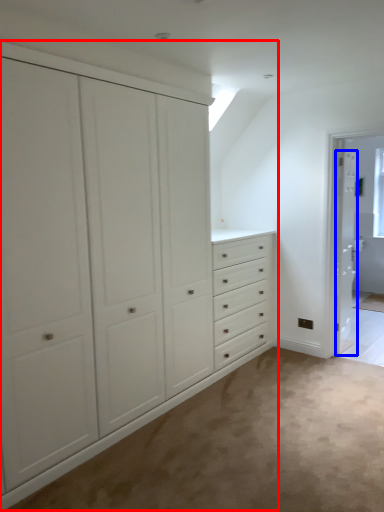
Question: Which point is closer to the camera, cupboard (highlighted by a red box) or door (highlighted by a blue box)?

Choices:
 (A) cupboard
 (B) door

Answer: (A)